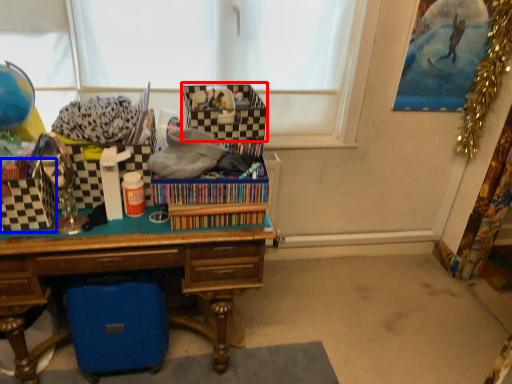
Question: Which point is further to the camera, storage box (highlighted by a red box) or storage box (highlighted by a blue box)?

Choices:
 (A) storage box
 (B) storage box

Answer: (A)